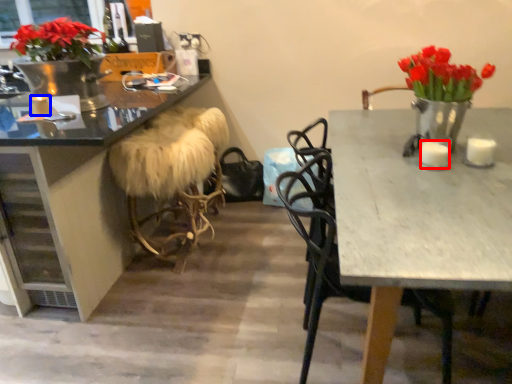
Question: Which point is closer to the camera, candle (highlighted by a red box) or candle (highlighted by a blue box)?

Choices:
 (A) candle
 (B) candle

Answer: (A)